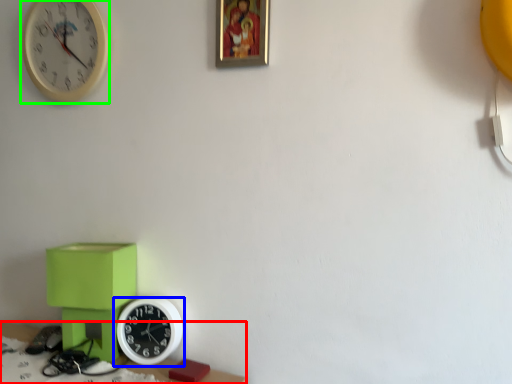
Question: Based on their relative distances, which object is farther from table (highlighted by a red box)? Choose from wall clock (highlighted by a blue box) and wall clock (highlighted by a green box).

Choices:
 (A) wall clock
 (B) wall clock

Answer: (B)